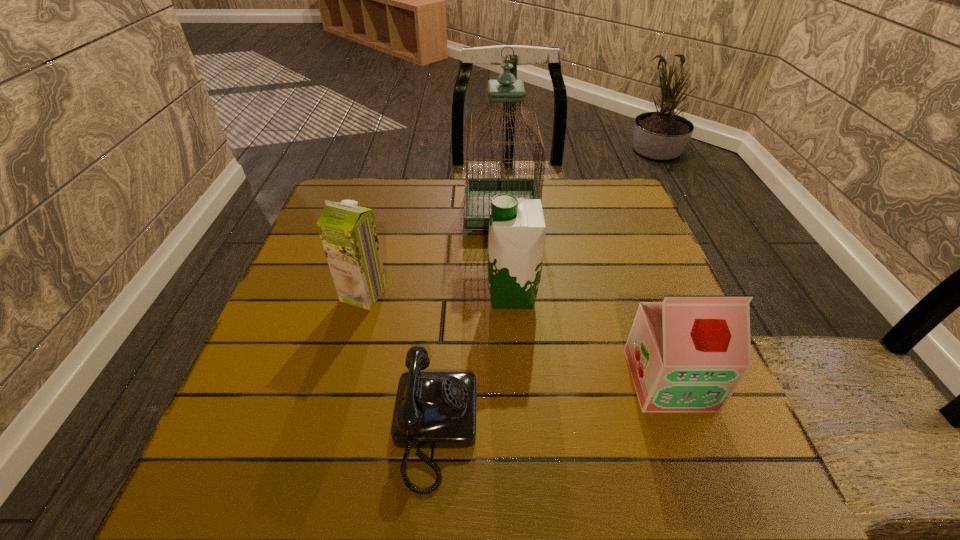
This screenshot has width=960, height=540. In order to click on birdcage in this screenshot , I will do point(479,191).

Find the location of a particular element. the farthest object is located at coordinates (479, 191).

Find the location of `the second soya milk from right to left`. the second soya milk from right to left is located at coordinates (516, 240).

Locate an element on the screen. The image size is (960, 540). the leftmost object is located at coordinates (348, 233).

Identify the location of the rightmost object. (x=688, y=353).

Image resolution: width=960 pixels, height=540 pixels. I want to click on the nearest soya milk, so click(x=688, y=353).

The height and width of the screenshot is (540, 960). Find the location of `telephone`. telephone is located at coordinates (433, 409).

This screenshot has width=960, height=540. Find the location of `free region located 0.140m at the door of the farthest object`. free region located 0.140m at the door of the farthest object is located at coordinates (413, 214).

This screenshot has height=540, width=960. What are the coordinates of `free spot located at the door of the farthest object` in the screenshot? It's located at (384, 214).

Locate an element on the screen. Image resolution: width=960 pixels, height=540 pixels. vacant region located 0.220m at the door of the farthest object is located at coordinates (384, 214).